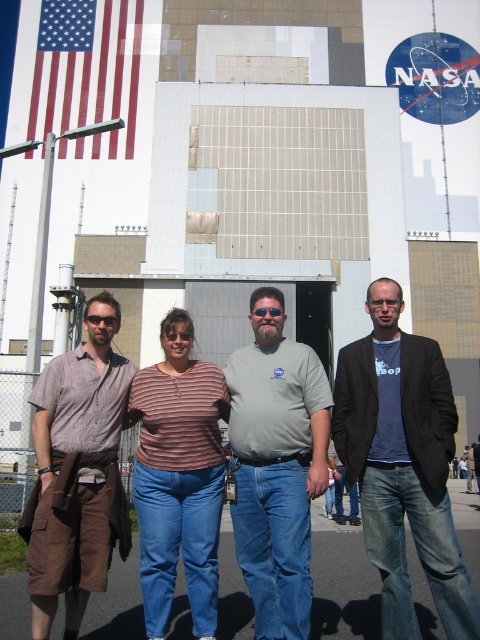
Question: Considering the real-world distances, which object is farthest from the brown cotton cargo shorts at left?

Choices:
 (A) striped cotton shirt at center
 (B) dark blue t-shirt at center
 (C) matte black goggles at center
 (D) gray cotton t-shirt at center

Answer: (B)

Question: Which point is farther to the camera?

Choices:
 (A) (48, 445)
 (B) (276, 312)
 (C) (152, 532)
 (D) (46, 12)

Answer: (D)

Question: Is the position of dark blue t-shirt at center more distant than that of sunglasses at center?

Choices:
 (A) yes
 (B) no

Answer: (B)

Question: Does brown cotton cargo shorts at left appear on the right side of matte black goggles at center?

Choices:
 (A) no
 (B) yes

Answer: (A)

Question: Which point appears closest to the camera in this image?

Choices:
 (A) (374, 384)
 (B) (277, 307)

Answer: (A)

Question: Is striped cotton shirt at center to the right of matte black goggles at center from the viewer's perspective?

Choices:
 (A) no
 (B) yes

Answer: (B)